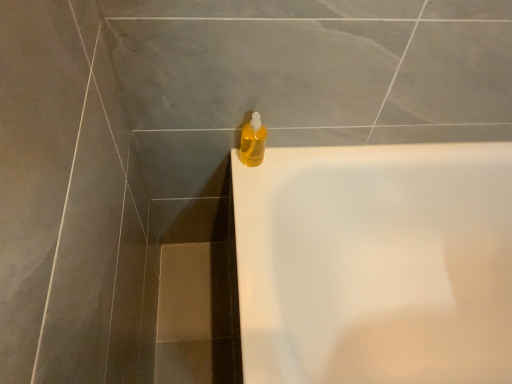
Where is `free location to the right of translucent yellow liquid at upper right`? The height and width of the screenshot is (384, 512). free location to the right of translucent yellow liquid at upper right is located at coordinates (292, 157).